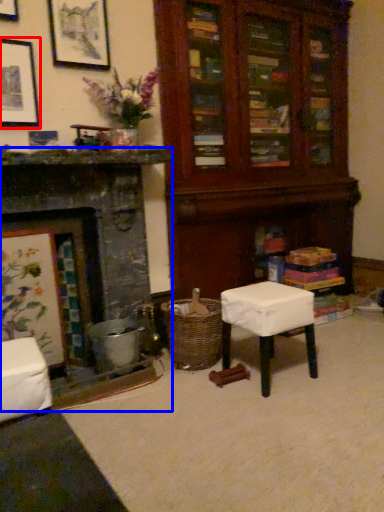
Question: Which object is closer to the camera taking this photo, picture frame (highlighted by a red box) or fireplace (highlighted by a blue box)?

Choices:
 (A) picture frame
 (B) fireplace

Answer: (B)